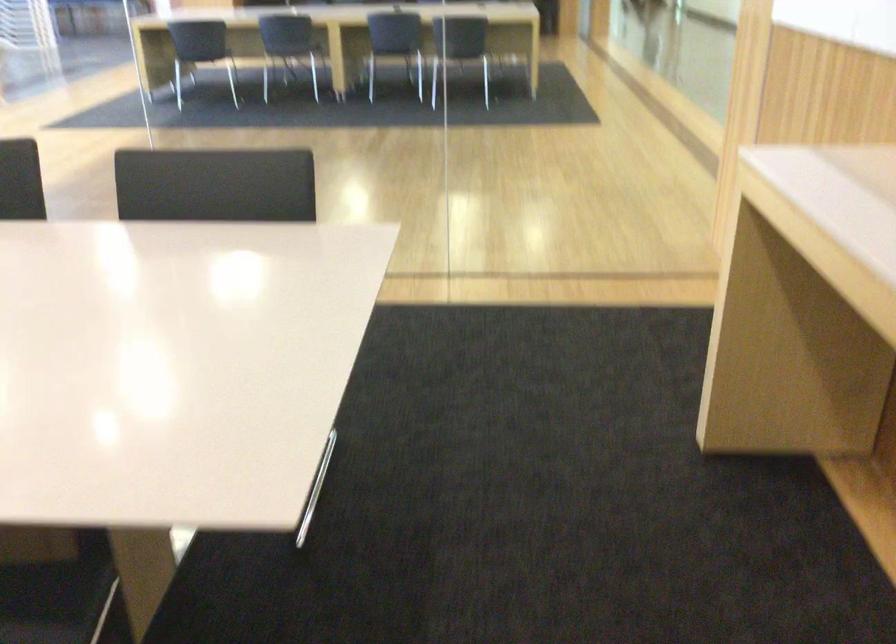
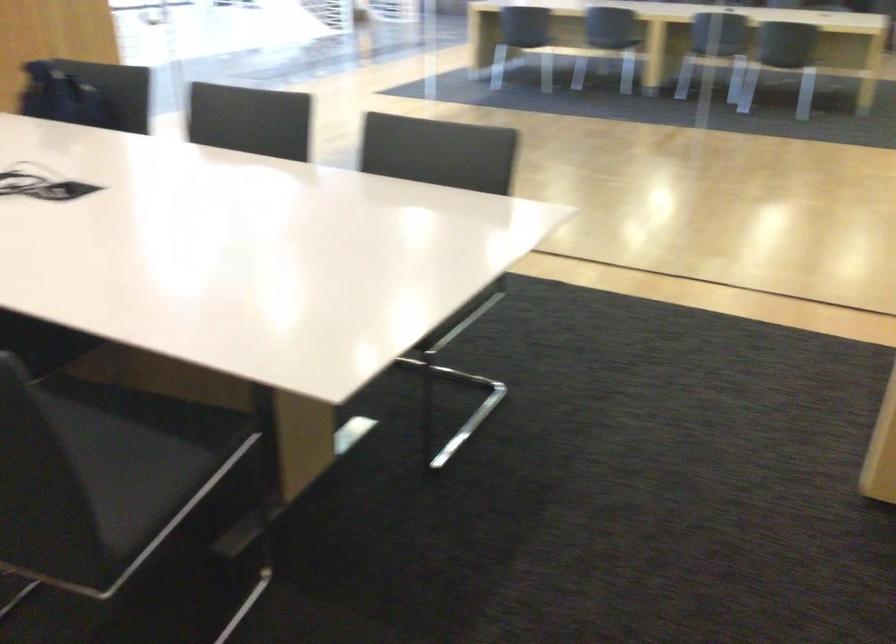
Question: The images are taken continuously from a first-person perspective. In which direction is your viewpoint rotating?

Choices:
 (A) Left
 (B) Right
 (C) Up
 (D) Down

Answer: (A)